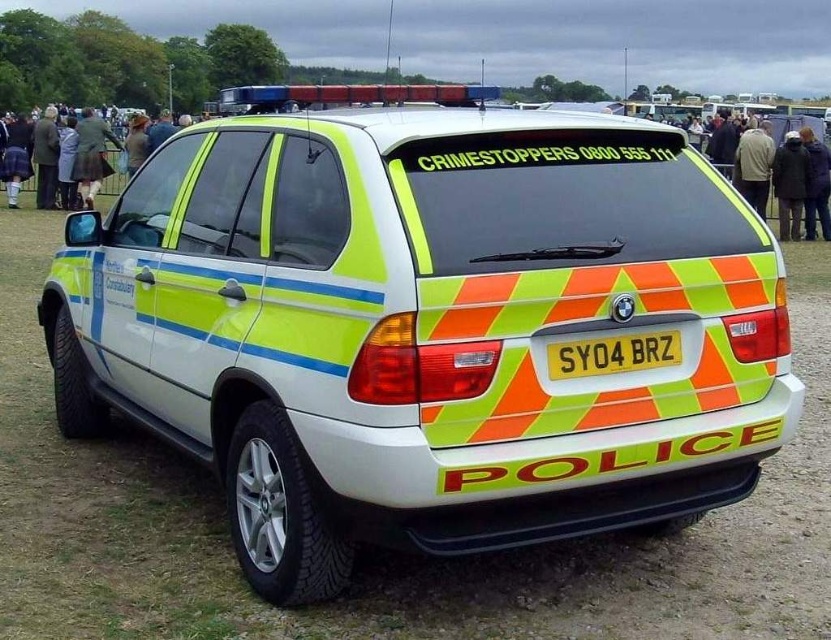
What do you see at coordinates (790, 182) in the screenshot?
I see `dark brown leather coat at right` at bounding box center [790, 182].

Between dark brown leather coat at right and brown leather jacket at upper center, which one is positioned higher?

brown leather jacket at upper center is higher up.

Find the location of a particular element. dark brown leather coat at right is located at coordinates (790, 182).

Find the location of a particular element. This screenshot has width=831, height=640. dark brown leather coat at right is located at coordinates (790, 182).

From the picture: Between reflective fluorescent police car at center and yellow plastic license plate at rear, which one is positioned lower?

yellow plastic license plate at rear is below.

The height and width of the screenshot is (640, 831). What are the coordinates of `reflective fluorescent police car at center` in the screenshot? It's located at (426, 328).

Is point (307, 259) more distant than point (558, 362)?

Yes, it is behind point (558, 362).

Identify the location of reflective fluorescent police car at center. (426, 328).

Looking at this image, who is positioned more to the left, yellow plastic license plate at rear or brown leather jacket at upper center?

From the viewer's perspective, brown leather jacket at upper center appears more on the left side.

Who is shorter, yellow plastic license plate at rear or brown leather jacket at upper center?

yellow plastic license plate at rear is shorter.

Does point (574, 376) come closer to viewer compared to point (126, 170)?

Yes, point (574, 376) is closer to viewer.

Where is `yellow plastic license plate at rear`? The height and width of the screenshot is (640, 831). yellow plastic license plate at rear is located at coordinates (612, 355).